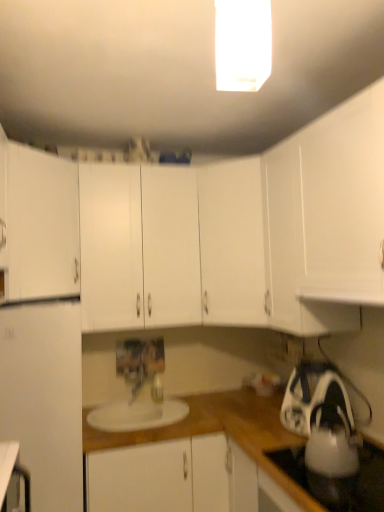
Question: In the image, is white matte cabinet at center, the 3th cabinetry in the bottom-to-top sequence, positioned in front of or behind white matte cabinet at left, placed as the fourth cabinetry when sorted from bottom to top?

Choices:
 (A) front
 (B) behind

Answer: (B)

Question: In terms of width, does white matte cabinet at center, the 3th cabinetry in the bottom-to-top sequence, look wider or thinner when compared to white matte cabinet at left, which appears as the first cabinetry when viewed from the top?

Choices:
 (A) thin
 (B) wide

Answer: (B)

Question: Which of these objects is positioned closest to the white matte refrigerator at left?

Choices:
 (A) white glossy tea pot at lower right
 (B) white matte cabinet at center, the 3th cabinetry in the bottom-to-top sequence
 (C) white matte cabinet at center, the third cabinetry viewed from the top
 (D) white matte cabinet at center, which ranks as the first cabinetry in bottom-to-top order
 (E) white glossy rectangular light fixture at upper center

Answer: (D)

Question: Based on their relative distances, which object is farther from the white glossy tea pot at lower right?

Choices:
 (A) white matte cabinet at center, the third cabinetry viewed from the top
 (B) white matte iron at lower right
 (C) white glossy gas stove at lower right
 (D) white matte cabinet at center, the second cabinetry in the top-to-bottom sequence
 (E) white matte cabinet at center, the fourth cabinetry positioned from the top

Answer: (A)